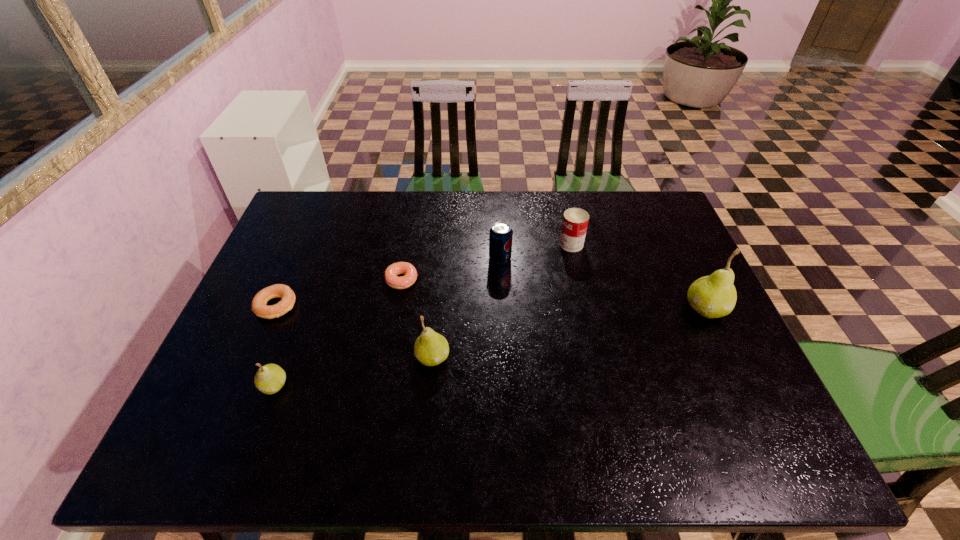
Where is `pear located at the left edge`? The image size is (960, 540). pear located at the left edge is located at coordinates (270, 378).

Image resolution: width=960 pixels, height=540 pixels. What are the coordinates of `bagel that is at the left edge` in the screenshot? It's located at (259, 303).

Identify the location of object situated at the right edge. (714, 296).

You are a GUI agent. You are given a task and a screenshot of the screen. Output one action in this format:
    pyautogui.click(x=<x>, y=<y>)
    Task: Click on the object located at the near left corner
    The height and width of the screenshot is (540, 960).
    Given the screenshot: What is the action you would take?
    pyautogui.click(x=270, y=378)

The width and height of the screenshot is (960, 540). I want to click on free location at the far edge, so click(433, 232).

The height and width of the screenshot is (540, 960). I want to click on vacant space at the near edge, so click(328, 393).

In the image, there is a desktop. Identify the location of free space at the left edge. Image resolution: width=960 pixels, height=540 pixels. (254, 314).

In the image, there is a desktop. Where is `free space at the right edge`? The width and height of the screenshot is (960, 540). free space at the right edge is located at coordinates (675, 310).

Find the location of a particular element. free spot at the far left corner of the desktop is located at coordinates pyautogui.click(x=335, y=198).

At what (x,y) coordinates should I click in order to perform the action: click on vacant area at the far right corner. Please return your answer as a coordinate pair (x, y). Looking at the image, I should click on (637, 198).